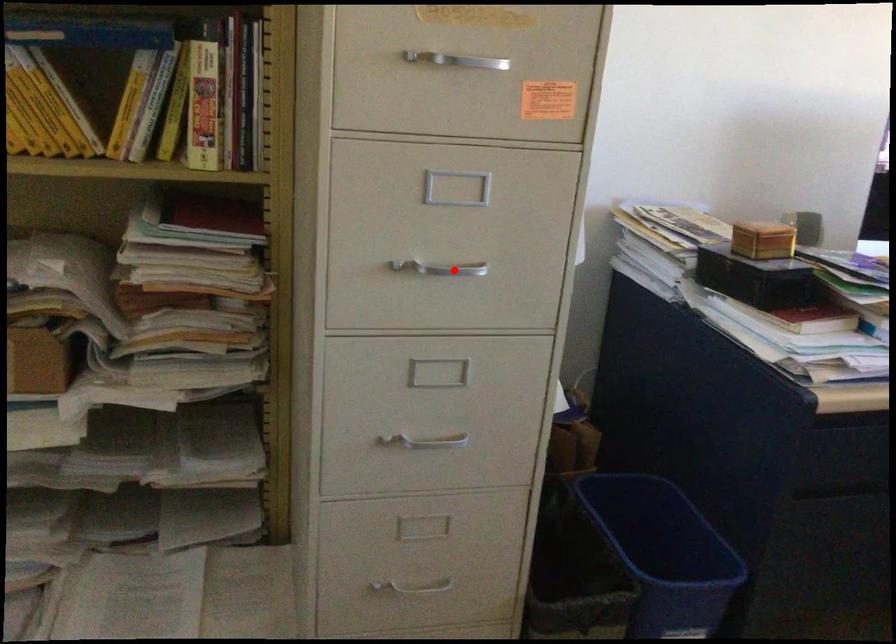
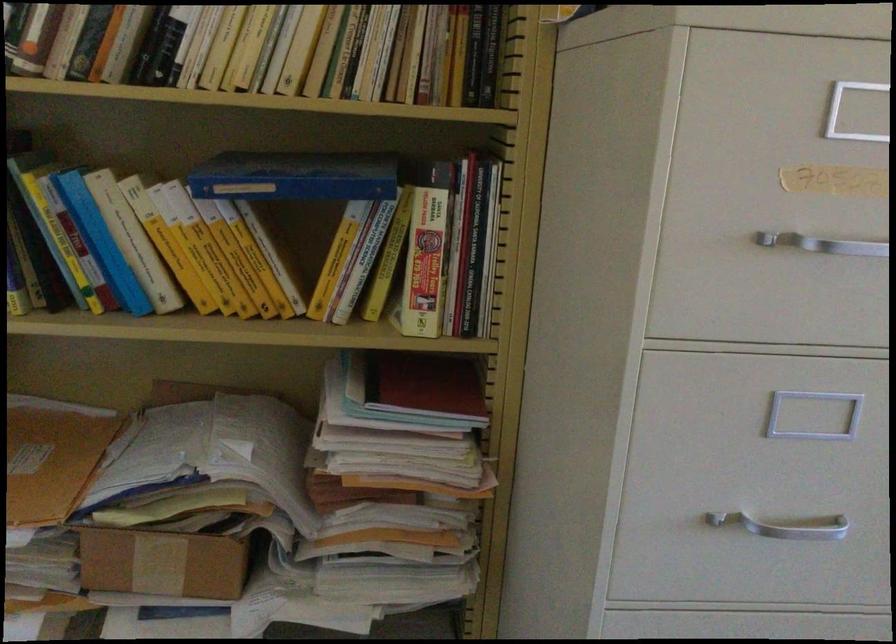
Question: I am providing you with two images of the same scene from different viewpoints. A red point is shown in image1. For the corresponding object point in image2, is it positioned nearer or farther from the camera?

Choices:
 (A) Nearer
 (B) Farther

Answer: (A)